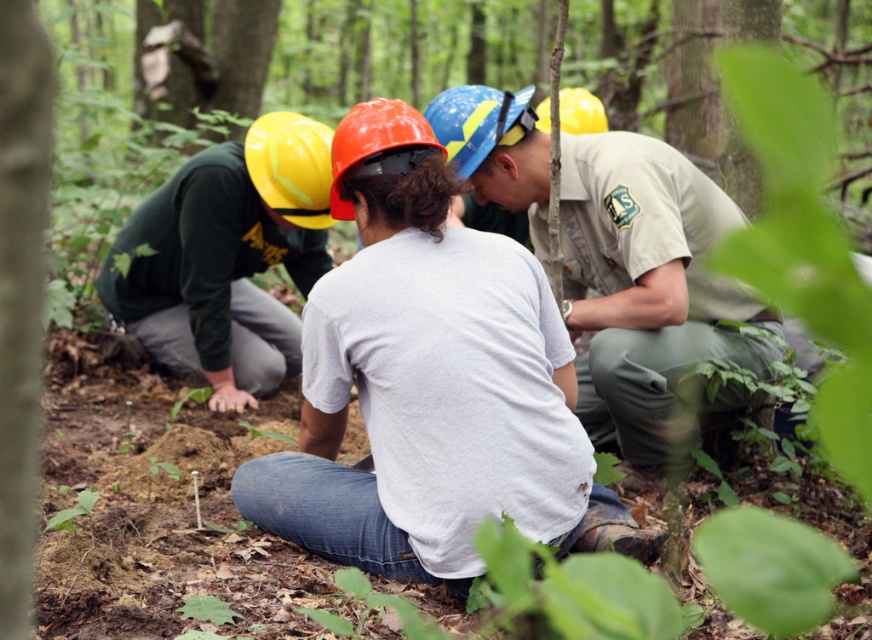
Find the location of `white matte shirt at center`. white matte shirt at center is located at coordinates (426, 380).

Between white matte shirt at center and khaki uniform at center, which one has less height?

Standing shorter between the two is khaki uniform at center.

Is point (519, 348) farther from viewer compared to point (665, 305)?

That is False.

You are a GUI agent. You are given a task and a screenshot of the screen. Output one action in this format:
    pyautogui.click(x=<x>, y=<y>)
    Task: Click on the white matte shirt at center
    This screenshot has height=640, width=872.
    Given the screenshot: What is the action you would take?
    pyautogui.click(x=426, y=380)

Is white matte shirt at center positioned in front of yellow matte helmet at upper right?

Yes, white matte shirt at center is in front of yellow matte helmet at upper right.

Which is below, white matte shirt at center or yellow matte helmet at upper right?

white matte shirt at center

You are a GUI agent. You are given a task and a screenshot of the screen. Output one action in this format:
    pyautogui.click(x=<x>, y=<y>)
    Task: Click on the white matte shirt at center
    
    Given the screenshot: What is the action you would take?
    pyautogui.click(x=426, y=380)

Does orange matte helmet at center have a greater height compared to yellow matte helmet at upper right?

In fact, orange matte helmet at center may be shorter than yellow matte helmet at upper right.

The width and height of the screenshot is (872, 640). I want to click on orange matte helmet at center, so click(372, 140).

You are a GUI agent. You are given a task and a screenshot of the screen. Output one action in this format:
    pyautogui.click(x=<x>, y=<y>)
    Task: Click on the orange matte helmet at center
    The image size is (872, 640).
    Given the screenshot: What is the action you would take?
    pyautogui.click(x=372, y=140)